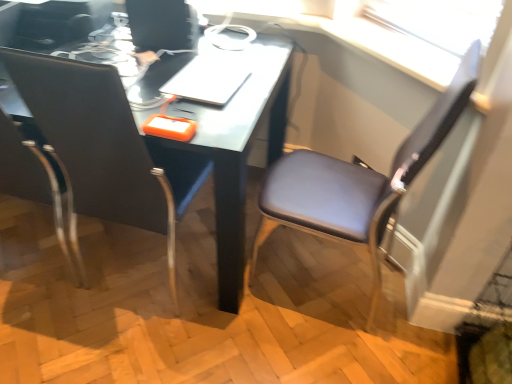
This screenshot has height=384, width=512. I want to click on vacant space underneath matte black chair at right, the second chair in the left-to-right sequence (from a real-world perspective), so click(x=320, y=274).